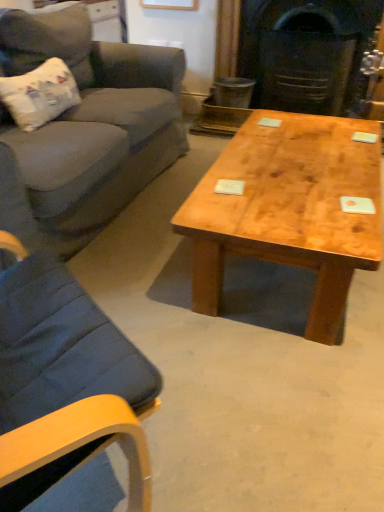
Question: From the image's perspective, relative to natural wood coffee table at center, is white paper-like pillow at left above or below?

Choices:
 (A) above
 (B) below

Answer: (A)

Question: Would you say white paper-like pillow at left is to the left or to the right of natural wood coffee table at center in the picture?

Choices:
 (A) left
 (B) right

Answer: (A)

Question: Considering the real-world distances, which object is closest to the dark gray stone fireplace at center?

Choices:
 (A) velvet gray couch at left
 (B) natural wood coffee table at center
 (C) white paper-like pillow at left

Answer: (A)

Question: Estimate the real-world distances between objects in this image. Which object is closer to the white paper-like pillow at left?

Choices:
 (A) dark gray stone fireplace at center
 (B) velvet gray couch at left
 (C) natural wood coffee table at center

Answer: (B)